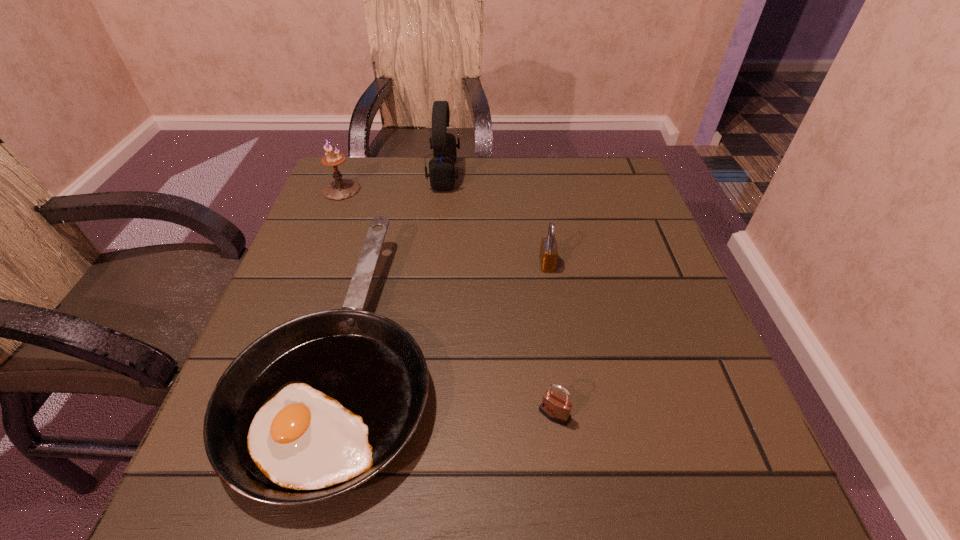
I want to click on headset, so click(x=442, y=174).

Where is `candle holder`? The image size is (960, 540). candle holder is located at coordinates (341, 188).

Locate an element on the screen. the farther padlock is located at coordinates (548, 255).

Image resolution: width=960 pixels, height=540 pixels. I want to click on the taller padlock, so click(548, 255).

At what (x,y) coordinates should I click in order to perform the action: click on the nearer padlock. Please return your answer as a coordinate pair (x, y). This screenshot has height=540, width=960. Looking at the image, I should click on (556, 407).

Image resolution: width=960 pixels, height=540 pixels. Identify the location of frying pan. (x=315, y=407).

At what (x,y) coordinates should I click in order to perform the action: click on vacant space located 0.250m on the headband of the headset. Please return your answer as a coordinate pair (x, y). Image resolution: width=960 pixels, height=540 pixels. Looking at the image, I should click on (553, 174).

Locate an element on the screen. This screenshot has width=960, height=540. vacant space located on the back of the candle holder is located at coordinates (352, 161).

Identify the location of vacant space located 0.230m on the right of the farther padlock. The width and height of the screenshot is (960, 540). (662, 264).

Find the location of `vacant space positioned 0.080m on the left of the shorter padlock`. vacant space positioned 0.080m on the left of the shorter padlock is located at coordinates (488, 414).